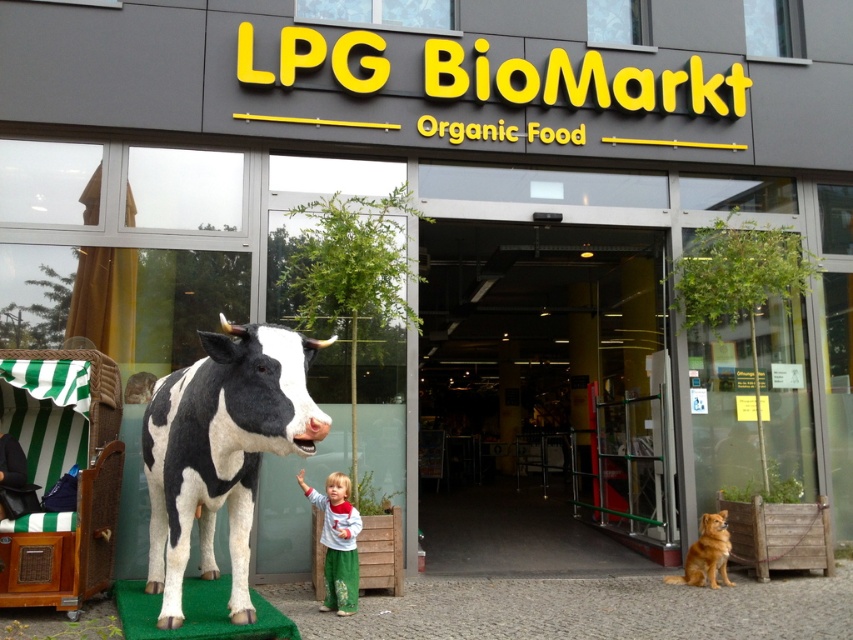
Which is below, black and white polka dot bull at center or matte gray pants at lower center?

matte gray pants at lower center

Does point (276, 380) come closer to viewer compared to point (341, 614)?

That is True.

Where is `black and white polka dot bull at center`? This screenshot has width=853, height=640. black and white polka dot bull at center is located at coordinates (221, 451).

Where is `black and white polka dot bull at center`? Image resolution: width=853 pixels, height=640 pixels. black and white polka dot bull at center is located at coordinates (221, 451).

Consider the image. Does glass door at center have a lesser height compared to black and white polka dot bull at center?

No, glass door at center is not shorter than black and white polka dot bull at center.

Is glass door at center above black and white polka dot bull at center?

No, glass door at center is not above black and white polka dot bull at center.

Which is in front, point (497, 296) or point (164, 604)?

Point (164, 604)

The image size is (853, 640). I want to click on glass door at center, so click(x=547, y=368).

This screenshot has height=640, width=853. Describe the element at coordinates (547, 368) in the screenshot. I see `glass door at center` at that location.

Can you confirm if glass door at center is positioned below matte gray pants at lower center?

Actually, glass door at center is above matte gray pants at lower center.

Does point (519, 467) come in front of point (326, 552)?

No.

Find the location of `glass door at center`. glass door at center is located at coordinates (547, 368).